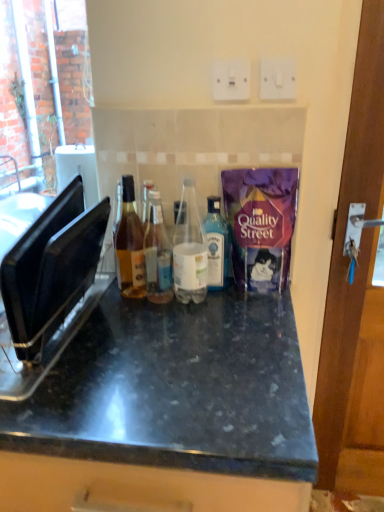
You are a GUI agent. You are given a task and a screenshot of the screen. Output one action in this format:
    pyautogui.click(x=<x>, y=<y>)
    Task: Click on the vacant space positioned to the left of translucent plastic bottle at center, the third bottle when ordered from left to right
    
    Given the screenshot: What is the action you would take?
    pyautogui.click(x=125, y=307)